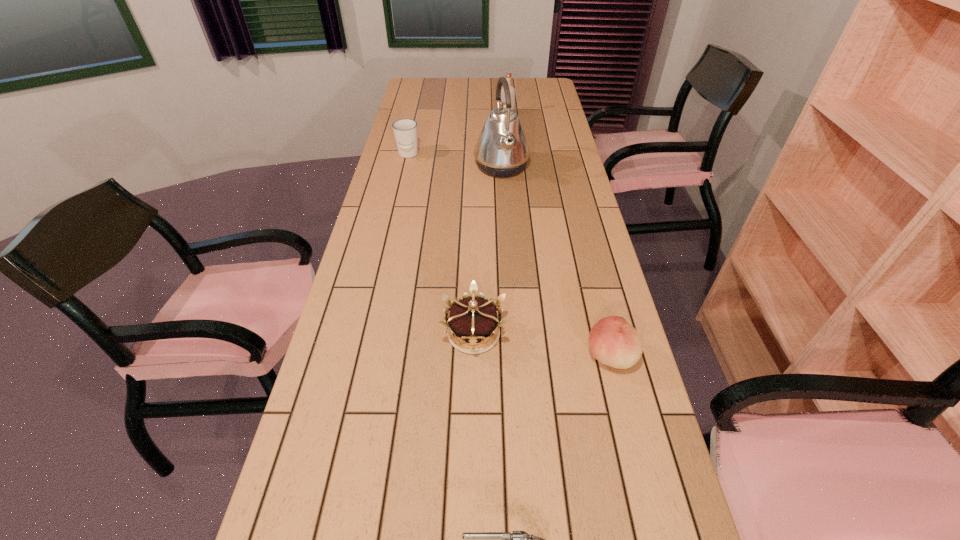
The image size is (960, 540). What are the coordinates of `kettle` in the screenshot? It's located at (502, 150).

Locate an element on the screen. The height and width of the screenshot is (540, 960). the second tallest object is located at coordinates (508, 76).

Where is `the farthest object`? Image resolution: width=960 pixels, height=540 pixels. the farthest object is located at coordinates (508, 76).

Identify the location of cup. (405, 130).

In order to click on crown in this screenshot , I will do tap(472, 320).

This screenshot has height=540, width=960. What are the coordinates of `the rightmost object` in the screenshot? It's located at pos(612,341).

Image resolution: width=960 pixels, height=540 pixels. I want to click on vacant space located on the front of the tallest object, so pyautogui.click(x=508, y=261).

This screenshot has height=540, width=960. What are the coordinates of `free space located on the label of the farthest object` in the screenshot? It's located at (425, 113).

I want to click on vacant space located on the label of the farthest object, so click(x=410, y=113).

This screenshot has height=540, width=960. I want to click on blank area located on the label of the farthest object, so click(x=474, y=113).